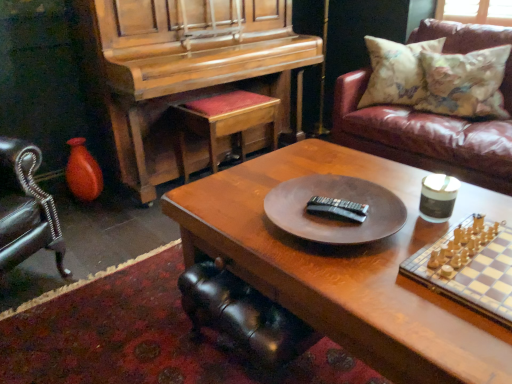
What do you see at coordinates (469, 267) in the screenshot? I see `wooden chessboard at right` at bounding box center [469, 267].

This screenshot has width=512, height=384. Identify the location of wooden cushioned stool at center. (224, 121).

Can you tell me how much floral fabric pillow at upper right, marked as the second pillow in a left-to-right arrangement, and wooden coffee table at center differ in facing direction?

22.3 degrees separate the facing orientations of floral fabric pillow at upper right, marked as the second pillow in a left-to-right arrangement, and wooden coffee table at center.

Who is bigger, floral fabric pillow at upper right, marked as the second pillow in a left-to-right arrangement, or wooden coffee table at center?

wooden coffee table at center.

There is a wooden coffee table at center. Where is `the 1st pillow above it (from the image's perspective)`? The image size is (512, 384). the 1st pillow above it (from the image's perspective) is located at coordinates (465, 83).

From a real-world perspective, is floral fabric pillow at upper right, marked as the second pillow in a left-to-right arrangement, located beneath wooden chessboard at right?

No, from a real-world perspective, floral fabric pillow at upper right, marked as the second pillow in a left-to-right arrangement, is not below wooden chessboard at right.

Is floral fabric pillow at upper right, arranged as the first pillow when viewed from the right, not near wooden chessboard at right?

Indeed, floral fabric pillow at upper right, arranged as the first pillow when viewed from the right, is not near wooden chessboard at right.

Which object is further away from the camera, floral fabric pillow at upper right, marked as the second pillow in a left-to-right arrangement, or wooden chessboard at right?

floral fabric pillow at upper right, marked as the second pillow in a left-to-right arrangement, is behind.

Considering the sizes of objects black leather swivel chair at lower center and floral fabric pillow at upper right, positioned as the 1th pillow in left-to-right order, in the image provided, who is thinner, black leather swivel chair at lower center or floral fabric pillow at upper right, positioned as the 1th pillow in left-to-right order,?

floral fabric pillow at upper right, positioned as the 1th pillow in left-to-right order, is thinner.

Does point (194, 317) come farther from viewer compared to point (376, 69)?

No.

Which object is positioned more to the left, black leather swivel chair at lower center or floral fabric pillow at upper right, positioned as the 2th pillow in right-to-left order?

black leather swivel chair at lower center is more to the left.

Is floral fabric pillow at upper right, positioned as the 2th pillow in right-to-left order, placed right next to wooden chessboard at right?

floral fabric pillow at upper right, positioned as the 2th pillow in right-to-left order, and wooden chessboard at right are not in contact.

Looking at the image, does floral fabric pillow at upper right, positioned as the 1th pillow in left-to-right order, seem bigger or smaller compared to wooden chessboard at right?

Clearly, floral fabric pillow at upper right, positioned as the 1th pillow in left-to-right order, is larger in size than wooden chessboard at right.

Can we say floral fabric pillow at upper right, positioned as the 2th pillow in right-to-left order, lies outside wooden chessboard at right?

floral fabric pillow at upper right, positioned as the 2th pillow in right-to-left order, lies outside wooden chessboard at right's area.

Between leather couch at upper right and black leather swivel chair at lower center, which one has larger width?

leather couch at upper right is wider.

Considering the relative positions of leather couch at upper right and black leather swivel chair at lower center in the image provided, is leather couch at upper right to the right of black leather swivel chair at lower center from the viewer's perspective?

Yes.

Consider the image. Is leather couch at upper right oriented away from black leather swivel chair at lower center?

No, leather couch at upper right's orientation is not away from black leather swivel chair at lower center.

Is leather couch at upper right not near black leather swivel chair at lower center?

Yes, leather couch at upper right and black leather swivel chair at lower center are located far from each other.

From the image's perspective, is floral fabric pillow at upper right, marked as the second pillow in a left-to-right arrangement, below wooden cushioned stool at center?

No, from the image's perspective, floral fabric pillow at upper right, marked as the second pillow in a left-to-right arrangement, is not below wooden cushioned stool at center.

Does point (466, 87) appear closer or farther from the camera than point (180, 113)?

Point (466, 87) is positioned closer to the camera compared to point (180, 113).

From a real-world perspective, between floral fabric pillow at upper right, arranged as the first pillow when viewed from the right, and wooden cushioned stool at center, who is vertically lower?

wooden cushioned stool at center.

How many degrees apart are the facing directions of floral fabric pillow at upper right, arranged as the first pillow when viewed from the right, and wooden cushioned stool at center?

floral fabric pillow at upper right, arranged as the first pillow when viewed from the right, and wooden cushioned stool at center are facing 114 degrees away from each other.

Is black leather swivel chair at lower center at the left side of floral fabric pillow at upper right, marked as the second pillow in a left-to-right arrangement?

Indeed, black leather swivel chair at lower center is positioned on the left side of floral fabric pillow at upper right, marked as the second pillow in a left-to-right arrangement.

Is black leather swivel chair at lower center thinner than floral fabric pillow at upper right, arranged as the first pillow when viewed from the right?

No, black leather swivel chair at lower center is not thinner than floral fabric pillow at upper right, arranged as the first pillow when viewed from the right.

Does point (215, 273) come closer to viewer compared to point (502, 69)?

Yes, it is.

Locate an element on the screen. The height and width of the screenshot is (384, 512). coffee table in front of the floral fabric pillow at upper right, arranged as the first pillow when viewed from the right is located at coordinates (342, 269).

Find the location of `board game lying below the floral fabric pillow at upper right, marked as the second pillow in a left-to-right arrangement (from the image's perspective)`. board game lying below the floral fabric pillow at upper right, marked as the second pillow in a left-to-right arrangement (from the image's perspective) is located at coordinates (469, 267).

When comparing their distances from leather couch at upper right, does wooden coffee table at center or wooden chessboard at right seem further?

wooden chessboard at right is positioned further to the anchor leather couch at upper right.

Which object lies further to the anchor point leather couch at upper right, polished wood piano at left or floral fabric pillow at upper right, positioned as the 1th pillow in left-to-right order?

polished wood piano at left is further to leather couch at upper right.

Consider the image. Looking at the image, which one is located closer to polished wood piano at left, black leather swivel chair at lower center or wooden cushioned stool at center?

Based on the image, wooden cushioned stool at center appears to be nearer to polished wood piano at left.

Based on the photo, which object lies further to the anchor point black leather swivel chair at lower center, wooden coffee table at center or polished wood piano at left?

Based on the image, polished wood piano at left appears to be further to black leather swivel chair at lower center.

When comparing their distances from wooden chessboard at right, does black leather swivel chair at lower center or wooden cushioned stool at center seem further?

wooden cushioned stool at center is positioned further to the anchor wooden chessboard at right.

Considering their positions, is wooden chessboard at right positioned closer to polished wood piano at left than wooden cushioned stool at center?

wooden cushioned stool at center is closer to polished wood piano at left.

From the picture: Based on their spatial positions, is wooden chessboard at right or floral fabric pillow at upper right, positioned as the 2th pillow in right-to-left order, closer to black leather swivel chair at lower center?

Among the two, wooden chessboard at right is located nearer to black leather swivel chair at lower center.

From the image, which object appears to be nearer to wooden chessboard at right, wooden cushioned stool at center or leather couch at upper right?

leather couch at upper right lies closer to wooden chessboard at right than the other object.

Identify the location of pillow situated between wooden cushioned stool at center and leather couch at upper right from left to right. (396, 72).

Locate an element on the screen. Image resolution: width=512 pixels, height=384 pixels. pillow between polished wood piano at left and leather couch at upper right is located at coordinates (396, 72).

Where is `piano between wooden coffee table at center and wooden cushioned stool at center in the front-back direction`? This screenshot has width=512, height=384. piano between wooden coffee table at center and wooden cushioned stool at center in the front-back direction is located at coordinates (189, 80).

Image resolution: width=512 pixels, height=384 pixels. What are the coordinates of `coffee table between polished wood piano at left and leather couch at upper right in the horizontal direction` in the screenshot? It's located at pyautogui.click(x=342, y=269).